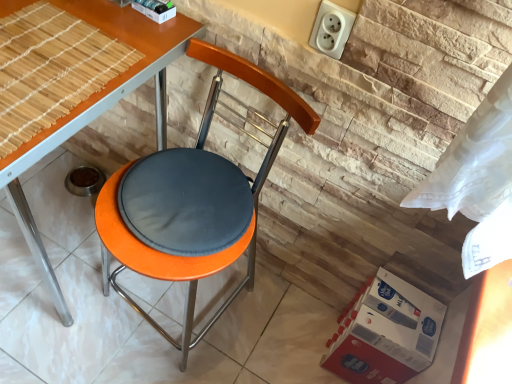
I want to click on vacant region under bamboo mat at upper left (from a real-world perspective), so click(x=47, y=68).